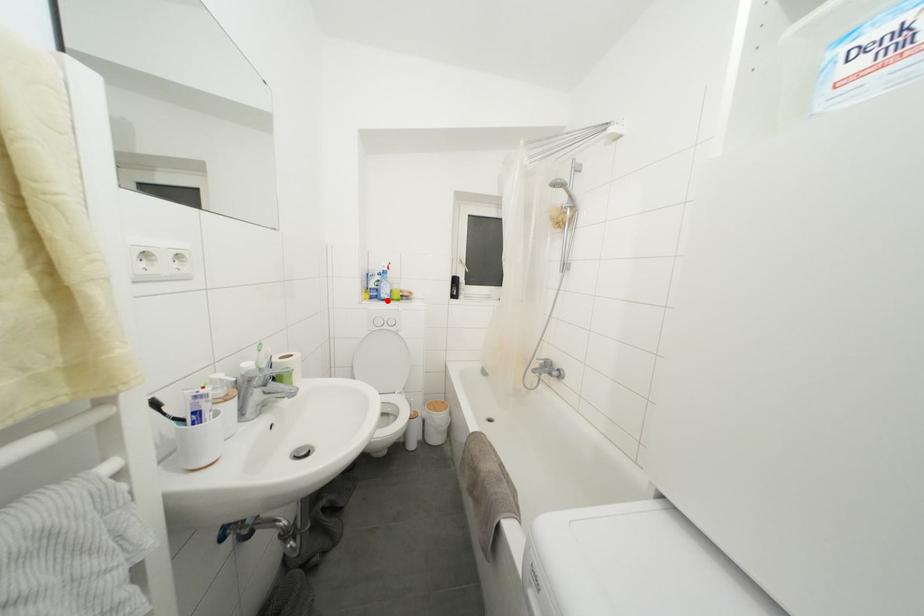
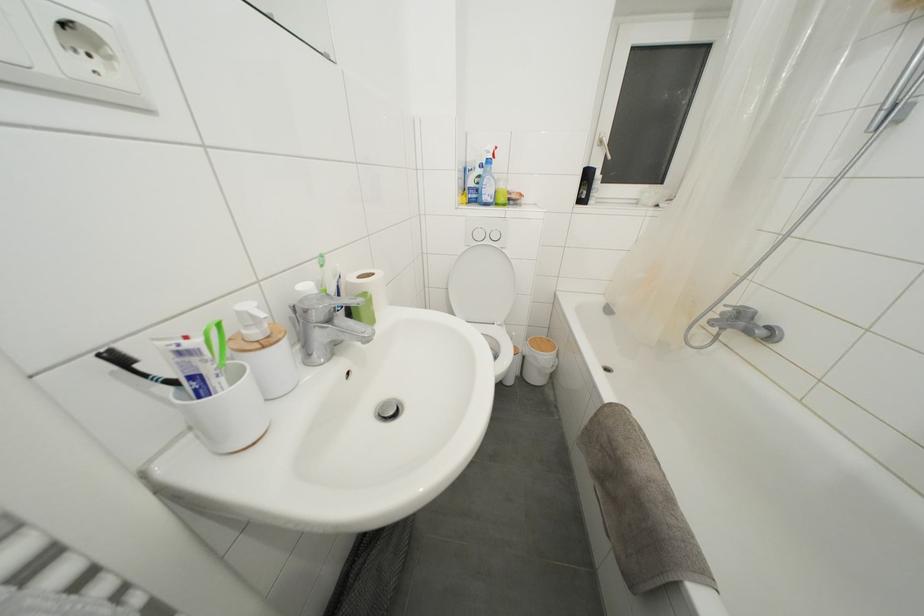
Locate, in the second image, the point that corresponds to the highlighted location in the first image.

(490, 203)